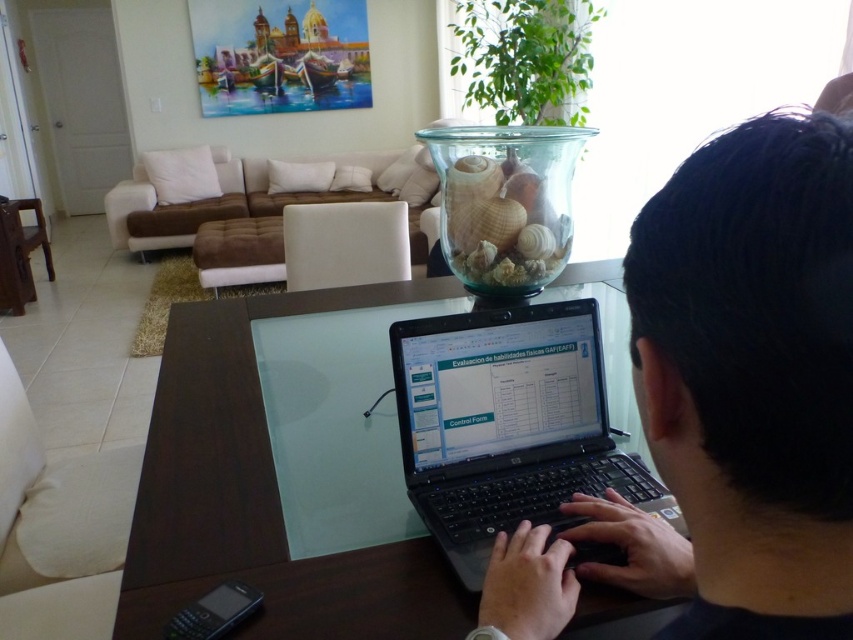
Question: Which object appears closest to the camera in this image?

Choices:
 (A) transparent glass table at center
 (B) black plastic laptop at center
 (C) black matte laptop at center

Answer: (C)

Question: Can you confirm if black matte laptop at center is bigger than transparent glass table at center?

Choices:
 (A) yes
 (B) no

Answer: (B)

Question: From the image, what is the correct spatial relationship of black matte laptop at center in relation to transparent glass table at center?

Choices:
 (A) above
 (B) below

Answer: (B)

Question: Among these objects, which one is nearest to the camera?

Choices:
 (A) black matte laptop at center
 (B) transparent glass table at center
 (C) black plastic laptop at center

Answer: (A)

Question: Does transparent glass table at center lie in front of black plastic laptop at center?

Choices:
 (A) no
 (B) yes

Answer: (B)

Question: Which object is closer to the camera taking this photo?

Choices:
 (A) black matte laptop at center
 (B) transparent glass table at center
 (C) black plastic laptop at center

Answer: (A)